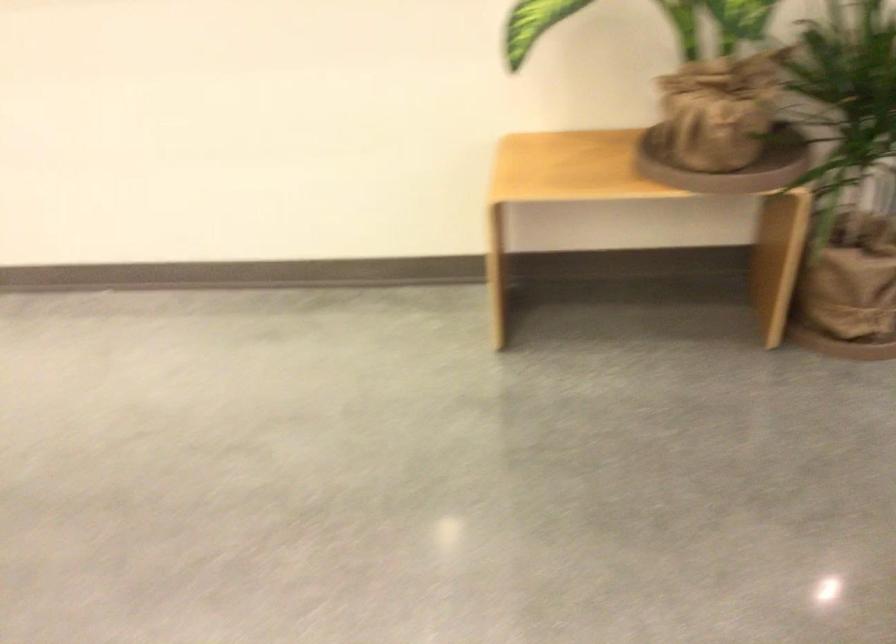
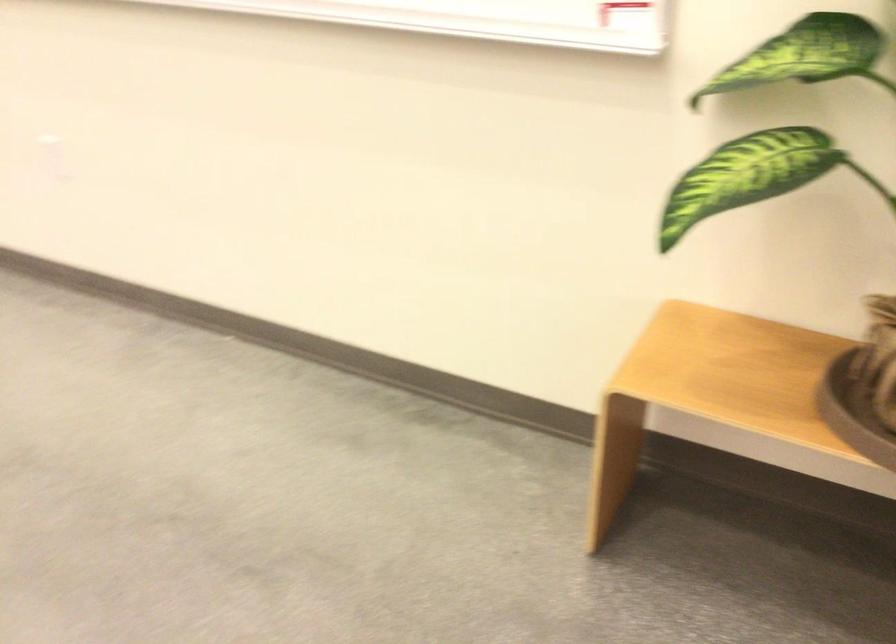
Where in the second image is the point corresponding to (x=661, y=167) from the first image?

(853, 413)